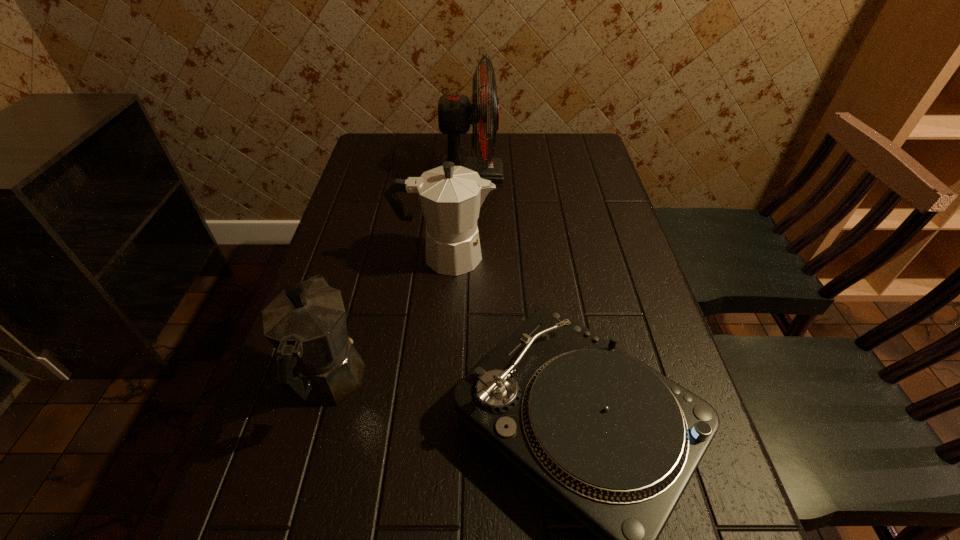
Find the location of a particular element. The image size is (960, 540). free region located on the pouring side of the left coffeepot is located at coordinates (360, 271).

Identify the location of object at the far edge. The width and height of the screenshot is (960, 540). (455, 112).

Find the location of a particular element. Image resolution: width=960 pixels, height=540 pixels. object located in the left edge section of the desktop is located at coordinates (317, 363).

You are a GUI agent. You are given a task and a screenshot of the screen. Output one action in this format:
    pyautogui.click(x=<x>, y=<y>)
    Task: Click on the vacant point at the far edge
    This screenshot has height=540, width=960.
    Given the screenshot: What is the action you would take?
    pyautogui.click(x=468, y=152)

You are a GUI agent. You are given a task and a screenshot of the screen. Output one action in this format:
    pyautogui.click(x=<x>, y=<y>)
    Task: Click on the free space at the left edge of the desktop
    
    Given the screenshot: What is the action you would take?
    pyautogui.click(x=308, y=465)

In the image, there is a desktop. Find the location of `free space at the right edge`. free space at the right edge is located at coordinates (604, 233).

You are a GUI agent. You are given a task and a screenshot of the screen. Output one action in this format:
    pyautogui.click(x=<x>, y=<y>)
    Task: Click on the vacant space at the far right corner of the desktop
    The image size is (960, 540).
    Given the screenshot: What is the action you would take?
    pyautogui.click(x=555, y=133)

The height and width of the screenshot is (540, 960). I want to click on vacant space that is in between the nearer coffeepot and the second farthest object, so 387,320.

At what (x,y) coordinates should I click in order to perform the action: click on empty space that is in between the second farthest object and the nearer coffeepot. Please return your answer as a coordinate pair (x, y). The height and width of the screenshot is (540, 960). Looking at the image, I should click on [x=387, y=320].

Identify which object is the third closest to the record player. Please provide its 2D coordinates. Your answer should be formatted as a tuple, i.e. [(x, y)], where the tuple contains the x and y coordinates of a point satisfying the conditions above.

[(455, 112)]